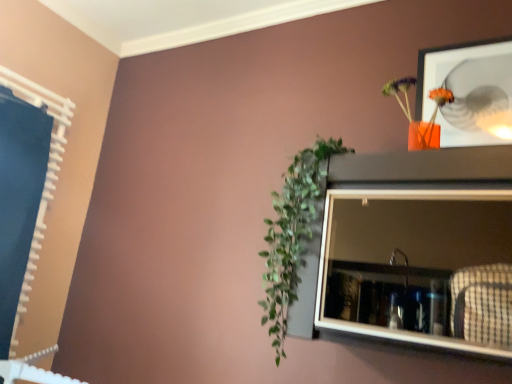
Question: From a real-world perspective, is matte gray medicine cabinet at upper right beneath green leafy plant at center-left?

Choices:
 (A) yes
 (B) no

Answer: (A)

Question: Can you confirm if matte gray medicine cabinet at upper right is shorter than green leafy plant at center-left?

Choices:
 (A) yes
 (B) no

Answer: (A)

Question: Does matte gray medicine cabinet at upper right touch green leafy plant at center-left?

Choices:
 (A) yes
 (B) no

Answer: (B)

Question: Is matte gray medicine cabinet at upper right at the left side of green leafy plant at center-left?

Choices:
 (A) yes
 (B) no

Answer: (B)

Question: Is matte gray medicine cabinet at upper right to the right of green leafy plant at center-left from the viewer's perspective?

Choices:
 (A) no
 (B) yes

Answer: (B)

Question: Considering the positions of green leafy plant at center-left and orange matte vase at upper right in the image, is green leafy plant at center-left bigger or smaller than orange matte vase at upper right?

Choices:
 (A) big
 (B) small

Answer: (A)

Question: In the image, is green leafy plant at center-left positioned in front of or behind orange matte vase at upper right?

Choices:
 (A) front
 (B) behind

Answer: (A)

Question: Is green leafy plant at center-left spatially inside orange matte vase at upper right, or outside of it?

Choices:
 (A) outside
 (B) inside

Answer: (A)

Question: From the image's perspective, is green leafy plant at center-left positioned above or below orange matte vase at upper right?

Choices:
 (A) above
 (B) below

Answer: (B)

Question: Based on their positions, is matte gray medicine cabinet at upper right located to the left or right of green leafy plant at center-left?

Choices:
 (A) left
 (B) right

Answer: (B)

Question: Considering their positions, is matte gray medicine cabinet at upper right located in front of or behind green leafy plant at center-left?

Choices:
 (A) front
 (B) behind

Answer: (A)

Question: Is matte gray medicine cabinet at upper right taller or shorter than green leafy plant at center-left?

Choices:
 (A) short
 (B) tall

Answer: (A)

Question: From a real-world perspective, relative to green leafy plant at center-left, is matte gray medicine cabinet at upper right vertically above or below?

Choices:
 (A) below
 (B) above

Answer: (A)

Question: Looking at the image, does green leafy plant at center-left seem bigger or smaller compared to matte gray medicine cabinet at upper right?

Choices:
 (A) big
 (B) small

Answer: (B)

Question: In the image, is green leafy plant at center-left positioned in front of or behind matte gray medicine cabinet at upper right?

Choices:
 (A) behind
 (B) front

Answer: (A)